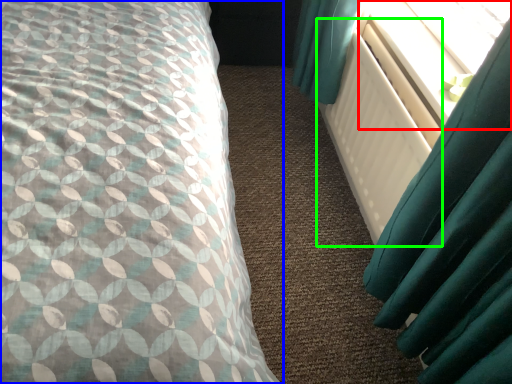
Question: Estimate the real-world distances between objects in this image. Which object is farther from window screen (highlighted by a red box), bed (highlighted by a blue box) or radiator (highlighted by a green box)?

Choices:
 (A) bed
 (B) radiator

Answer: (A)